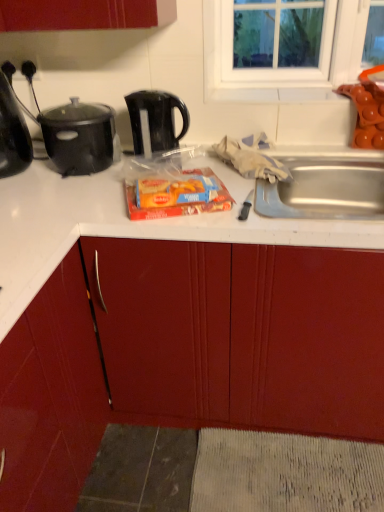
Locate an element on the screen. This screenshot has width=384, height=512. matte red cabinet at center is located at coordinates (187, 352).

The image size is (384, 512). What do you see at coordinates (156, 119) in the screenshot? I see `black plastic kettle at upper center` at bounding box center [156, 119].

Where is `black matte pot at upper left`? Image resolution: width=384 pixels, height=512 pixels. black matte pot at upper left is located at coordinates (76, 133).

What do you see at coordinates (177, 196) in the screenshot? Image resolution: width=384 pixels, height=512 pixels. I see `matte plastic snack pack at center` at bounding box center [177, 196].

You are a GUI agent. You are given a task and a screenshot of the screen. Output one action in this format:
    pyautogui.click(x=<x>, y=<y>)
    Task: Click on the matte red cabinet at center
    
    Given the screenshot: What is the action you would take?
    pyautogui.click(x=187, y=352)

Is matte plastic snack pack at center smaller than shiny black kettle at left?

Yes, matte plastic snack pack at center is smaller than shiny black kettle at left.

Is matte plastic snack pack at center oriented towards shiny black kettle at left?

No, matte plastic snack pack at center is not turned towards shiny black kettle at left.

Where is `food on the right of the shiny black kettle at left`? food on the right of the shiny black kettle at left is located at coordinates (x=177, y=196).

Can you confirm if matte plastic snack pack at center is taller than shiny black kettle at left?

In fact, matte plastic snack pack at center may be shorter than shiny black kettle at left.

Would you say shiny black kettle at left is inside or outside matte red cabinet at center?

The correct answer is: outside.

In terms of height, does shiny black kettle at left look taller or shorter compared to matte red cabinet at center?

Clearly, shiny black kettle at left is shorter compared to matte red cabinet at center.

Is point (2, 105) closer to camera compared to point (44, 351)?

No.

Which object is closer to the camera, shiny black kettle at left or matte red cabinet at center?

matte red cabinet at center is in front.

Is point (157, 147) positioned behind point (143, 219)?

That is True.

At what (x,y) coordinates should I click in order to perform the action: click on food on the right of black plastic kettle at upper center. Please return your answer as a coordinate pair (x, y). Looking at the image, I should click on (177, 196).

Considering the relative positions of black plastic kettle at upper center and matte plastic snack pack at center in the image provided, is black plastic kettle at upper center to the right of matte plastic snack pack at center from the viewer's perspective?

In fact, black plastic kettle at upper center is to the left of matte plastic snack pack at center.

From a real-world perspective, which object rests below the other?

From a 3D spatial view, matte plastic snack pack at center is below.

Choose the correct answer: Is matte red cabinet at center inside matte plastic snack pack at center or outside it?

matte red cabinet at center is outside matte plastic snack pack at center.

Consider the image. Considering the positions of objects matte red cabinet at center and matte plastic snack pack at center in the image provided, who is more to the right, matte red cabinet at center or matte plastic snack pack at center?

From the viewer's perspective, matte plastic snack pack at center appears more on the right side.

From the image's perspective, is matte red cabinet at center over matte plastic snack pack at center?

Incorrect, from the image's perspective, matte red cabinet at center is lower than matte plastic snack pack at center.

From a real-world perspective, is matte red cabinet at center above or below matte plastic snack pack at center?

matte red cabinet at center is situated lower than matte plastic snack pack at center in the real world.

From a real-world perspective, is shiny black kettle at left beneath matte plastic snack pack at center?

No, from a real-world perspective, shiny black kettle at left is not beneath matte plastic snack pack at center.

Is shiny black kettle at left not near matte plastic snack pack at center?

That's not correct — shiny black kettle at left is a little close to matte plastic snack pack at center.

Between shiny black kettle at left and matte plastic snack pack at center, which one has larger size?

With larger size is shiny black kettle at left.

Is shiny black kettle at left inside or outside of matte plastic snack pack at center?

The correct answer is: outside.

Image resolution: width=384 pixels, height=512 pixels. In order to click on kitchen appliance on the left of black plastic kettle at upper center in this screenshot , I will do `click(12, 133)`.

Is shiny black kettle at left oriented away from black plastic kettle at upper center?

shiny black kettle at left does not have its back to black plastic kettle at upper center.

From a real-world perspective, which object rests below the other?

black plastic kettle at upper center, from a real-world perspective.

Can you confirm if shiny black kettle at left is shorter than black plastic kettle at upper center?

No, shiny black kettle at left is not shorter than black plastic kettle at upper center.

Is matte plastic snack pack at center surrounding black plastic kettle at upper center?

That's incorrect, black plastic kettle at upper center is not inside matte plastic snack pack at center.

Looking at this image, are matte plastic snack pack at center and black plastic kettle at upper center far apart?

No, matte plastic snack pack at center is not far from black plastic kettle at upper center.

How many degrees apart are the facing directions of matte plastic snack pack at center and black plastic kettle at upper center?

The angle between the facing direction of matte plastic snack pack at center and the facing direction of black plastic kettle at upper center is 17.5 degrees.

Based on the photo, in the image, is matte plastic snack pack at center on the left side or the right side of black plastic kettle at upper center?

From the image, it's evident that matte plastic snack pack at center is to the right of black plastic kettle at upper center.

This screenshot has height=512, width=384. I want to click on food located underneath the shiny black kettle at left (from a real-world perspective), so tap(177, 196).

Where is `cabinetry below the shiny black kettle at left (from the image's perspective)`? This screenshot has height=512, width=384. cabinetry below the shiny black kettle at left (from the image's perspective) is located at coordinates (187, 352).

Which object lies nearer to the anchor point shiny black kettle at left, matte red cabinet at center or matte plastic snack pack at center?

Based on the image, matte plastic snack pack at center appears to be nearer to shiny black kettle at left.

Based on the photo, considering their positions, is black plastic kettle at upper center positioned further to matte red cabinet at center than black matte pot at upper left?

black plastic kettle at upper center lies further to matte red cabinet at center than the other object.

Looking at the image, which one is located closer to matte red cabinet at center, black matte pot at upper left or matte plastic snack pack at center?

The object closer to matte red cabinet at center is matte plastic snack pack at center.

Looking at the image, which one is located further to matte red cabinet at center, matte plastic snack pack at center or black plastic kettle at upper center?

black plastic kettle at upper center is positioned further to the anchor matte red cabinet at center.

Looking at the image, which one is located further to matte red cabinet at center, black plastic kettle at upper center or shiny black kettle at left?

Among the two, shiny black kettle at left is located further to matte red cabinet at center.

Estimate the real-world distances between objects in this image. Which object is further from matte plastic snack pack at center, shiny black kettle at left or black matte pot at upper left?

shiny black kettle at left is further to matte plastic snack pack at center.

When comparing their distances from black plastic kettle at upper center, does matte red cabinet at center or shiny black kettle at left seem closer?

shiny black kettle at left.

Considering their positions, is shiny black kettle at left positioned closer to black matte pot at upper left than matte red cabinet at center?

shiny black kettle at left lies closer to black matte pot at upper left than the other object.

The image size is (384, 512). I want to click on kitchen appliance between matte red cabinet at center and black plastic kettle at upper center from front to back, so click(x=12, y=133).

Identify the location of appliance between shiny black kettle at left and matte plastic snack pack at center from left to right. The image size is (384, 512). (76, 133).

Where is `food located between matte red cabinet at center and shiny black kettle at left in the depth direction`? This screenshot has width=384, height=512. food located between matte red cabinet at center and shiny black kettle at left in the depth direction is located at coordinates (177, 196).

The image size is (384, 512). What are the coordinates of `kettle between shiny black kettle at left and matte plastic snack pack at center in the horizontal direction` in the screenshot? It's located at (156, 119).